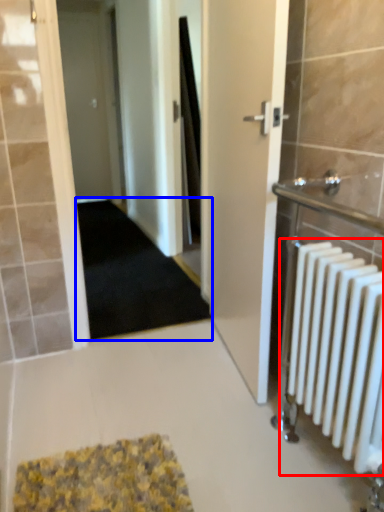
Question: Which object is further to the camera taking this photo, radiator (highlighted by a red box) or doormat (highlighted by a blue box)?

Choices:
 (A) radiator
 (B) doormat

Answer: (B)